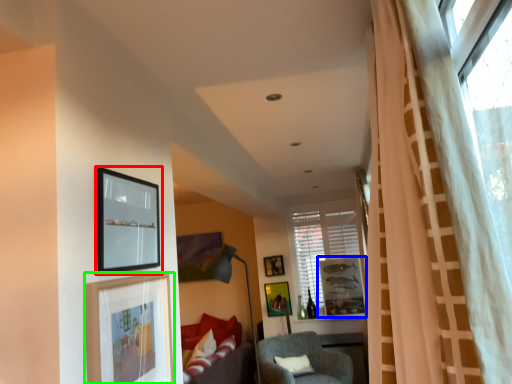
Question: Which object is positioned farthest from picture frame (highlighted by a red box)? Select from picture frame (highlighted by a blue box) and picture frame (highlighted by a green box).

Choices:
 (A) picture frame
 (B) picture frame

Answer: (A)